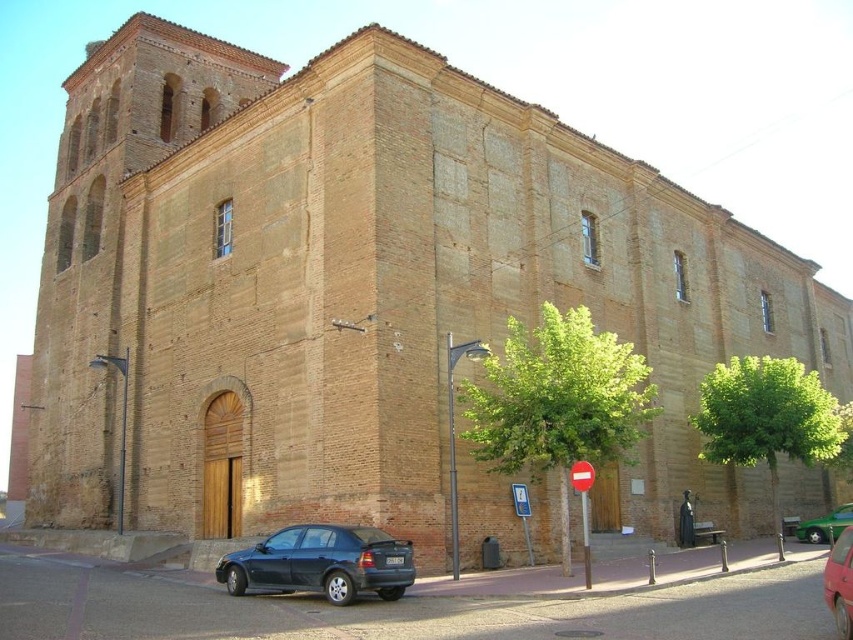
Question: Is green leafy tree at center positioned at the back of matte black sedan at lower left?

Choices:
 (A) yes
 (B) no

Answer: (A)

Question: Does green leafy tree at center have a larger size compared to green leafy tree at right?

Choices:
 (A) yes
 (B) no

Answer: (B)

Question: Which point is closer to the camera?

Choices:
 (A) (846, 577)
 (B) (718, 420)
 (C) (819, 540)

Answer: (A)

Question: Estimate the real-world distances between objects in this image. Which object is farther from the green glossy car at lower right?

Choices:
 (A) metallic red car at lower right
 (B) green leafy tree at center
 (C) green leafy tree at right

Answer: (B)

Question: Does green leafy tree at right come behind green glossy car at lower right?

Choices:
 (A) yes
 (B) no

Answer: (B)

Question: Among these points, which one is nearest to the camera?

Choices:
 (A) (819, 516)
 (B) (520, 436)

Answer: (B)